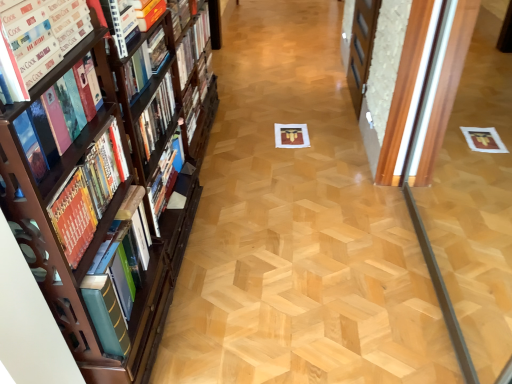
Question: Is wooden screen door at right next to matte hardcover book at left, which is the second book in front-to-back order, and touching it?

Choices:
 (A) yes
 (B) no

Answer: (B)

Question: Is matte hardcover book at left, marked as the fifth book in a back-to-front arrangement, a part of wooden screen door at right?

Choices:
 (A) no
 (B) yes

Answer: (A)

Question: Is wooden screen door at right to the right of matte hardcover book at left, marked as the fifth book in a back-to-front arrangement, from the viewer's perspective?

Choices:
 (A) yes
 (B) no

Answer: (A)

Question: Is wooden screen door at right smaller than matte hardcover book at left, marked as the fifth book in a back-to-front arrangement?

Choices:
 (A) no
 (B) yes

Answer: (A)

Question: Is the depth of wooden screen door at right greater than that of matte hardcover book at left, marked as the fifth book in a back-to-front arrangement?

Choices:
 (A) yes
 (B) no

Answer: (A)

Question: Is hardcover book at left, which appears as the first book when viewed from the front, to the left or to the right of hardcover book at upper center, positioned as the first book in back-to-front order, in the image?

Choices:
 (A) left
 (B) right

Answer: (A)

Question: In terms of width, does hardcover book at left, which appears as the first book when viewed from the front, look wider or thinner when compared to hardcover book at upper center, acting as the 6th book starting from the front?

Choices:
 (A) wide
 (B) thin

Answer: (A)

Question: Is point (140, 193) positioned closer to the camera than point (181, 84)?

Choices:
 (A) farther
 (B) closer

Answer: (B)

Question: Relative to hardcover book at upper center, acting as the 6th book starting from the front, is hardcover book at left, which is the 6th book from back to front, in front or behind?

Choices:
 (A) front
 (B) behind

Answer: (A)

Question: From the image's perspective, is hardcover book at left, which appears as the first book when viewed from the front, positioned above or below matte hardcover book at left, which is the second book in front-to-back order?

Choices:
 (A) below
 (B) above

Answer: (A)

Question: From a real-world perspective, is hardcover book at left, which is the 6th book from back to front, positioned above or below matte hardcover book at left, marked as the fifth book in a back-to-front arrangement?

Choices:
 (A) above
 (B) below

Answer: (B)

Question: Is point (58, 127) positioned closer to the camera than point (18, 16)?

Choices:
 (A) farther
 (B) closer

Answer: (A)

Question: Based on their positions, is hardcover book at left, which is the 6th book from back to front, located to the left or right of matte hardcover book at left, marked as the fifth book in a back-to-front arrangement?

Choices:
 (A) left
 (B) right

Answer: (A)

Question: Based on their sizes in the image, would you say hardcover book at left, placed as the 3th book when sorted from front to back, is bigger or smaller than wooden screen door at right?

Choices:
 (A) big
 (B) small

Answer: (B)

Question: Would you say hardcover book at left, which is counted as the 4th book, starting from the back, is to the left or to the right of wooden screen door at right in the picture?

Choices:
 (A) left
 (B) right

Answer: (A)